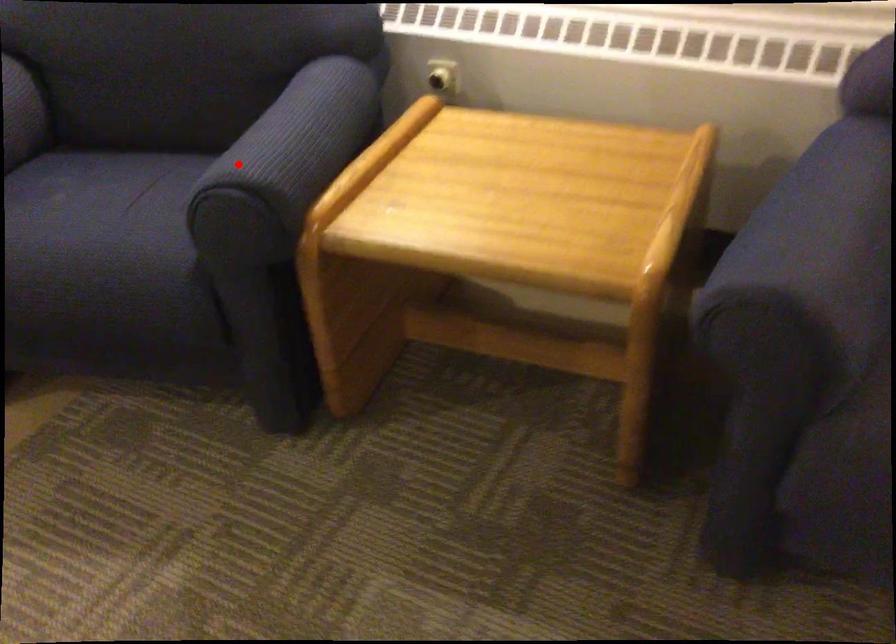
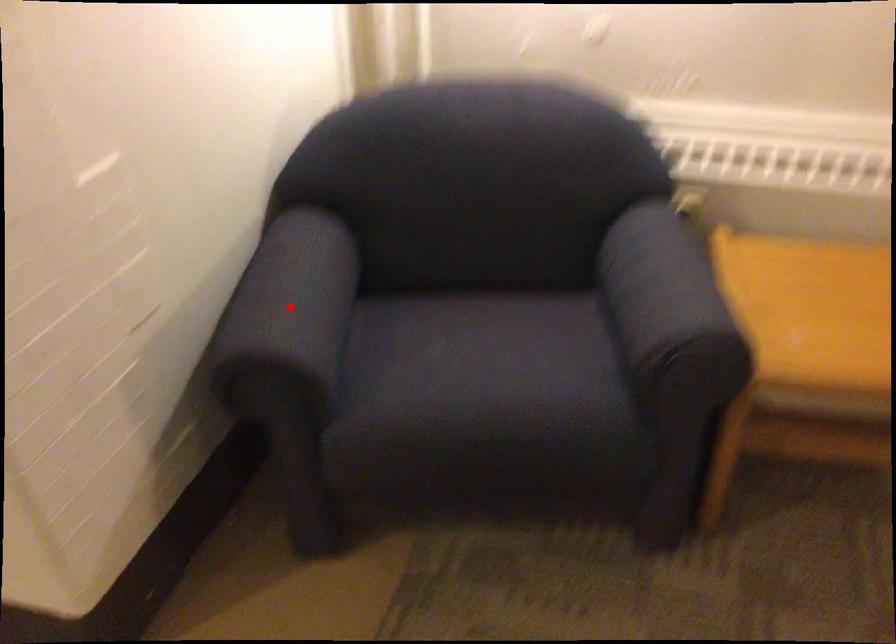
I am providing you with two images of the same scene from different viewpoints. A red point is marked on the first image and another point is marked on the second image. Is the red point in image1 aligned with the point shown in image2?

No